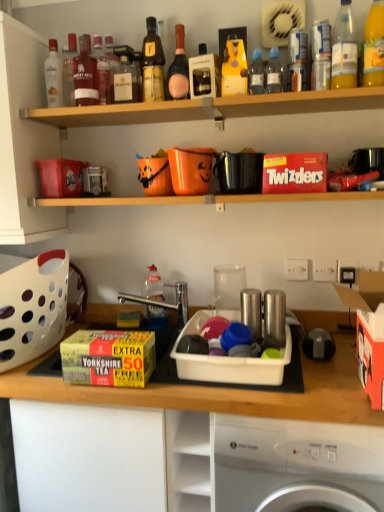
Question: Which is correct: matte glass bottle at upper left, placed as the 12th bottle when sorted from right to left, is inside transparent plastic bottle at upper center, placed as the 9th bottle when sorted from left to right, or outside of it?

Choices:
 (A) inside
 (B) outside

Answer: (B)

Question: Considering the positions of matte glass bottle at upper left, the first bottle when ordered from left to right, and transparent plastic bottle at upper center, placed as the 9th bottle when sorted from left to right, in the image, is matte glass bottle at upper left, the first bottle when ordered from left to right, wider or thinner than transparent plastic bottle at upper center, placed as the 9th bottle when sorted from left to right,?

Choices:
 (A) thin
 (B) wide

Answer: (B)

Question: Considering the real-world distances, which object is closest to the transparent plastic bottle at upper center, acting as the fourth bottle starting from the right?

Choices:
 (A) orange cardboard box at right
 (B) white plastic container at center, the 3th appliance from the top
 (C) transparent plastic bottle at center, which is the fourth bottle in left-to-right order
 (D) clear plastic bottle at upper right, the second bottle in the right-to-left sequence
 (E) matte glass whisky bottle at upper left, which is the eleventh bottle in right-to-left order

Answer: (D)

Question: Which is nearer to the translucent plastic bottle at upper right, the 12th bottle when ordered from left to right?

Choices:
 (A) white perforated basket at left
 (B) yellow plastic bottle at upper center, arranged as the 7th bottle when viewed from the left
 (C) yellow cardboard box at center, which is the 1th box from bottom to top
 (D) pink glass bottle at upper center, which is the 6th bottle in left-to-right order
 (E) matte plastic box at left, which is the first box in back-to-front order

Answer: (B)